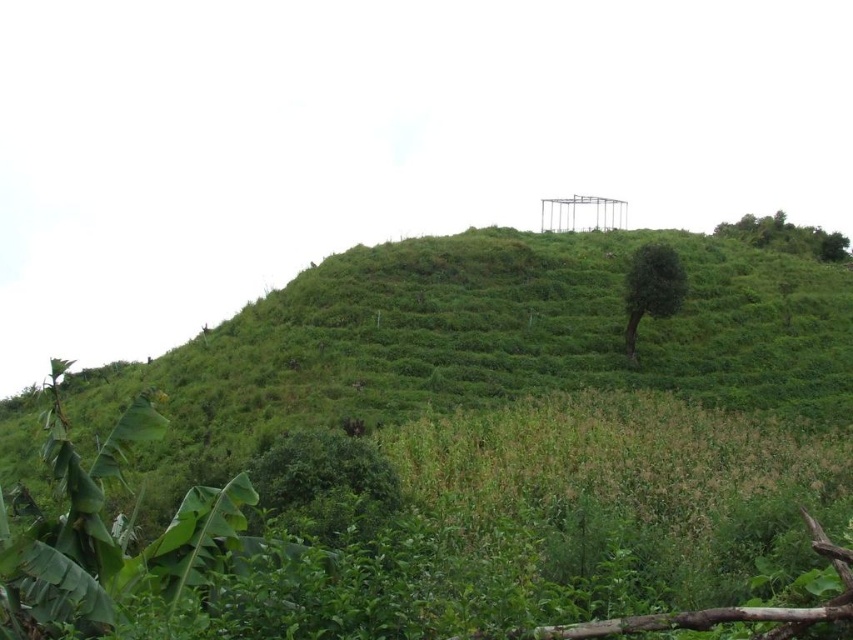
Is green leafy tree at center thinner than green leafy tree at upper right?

Yes.

Which is above, green leafy tree at center or green leafy tree at upper right?

green leafy tree at upper right

Who is more forward, (665, 250) or (769, 243)?

Point (665, 250) is more forward.

Where is `green leafy tree at center`? green leafy tree at center is located at coordinates (651, 285).